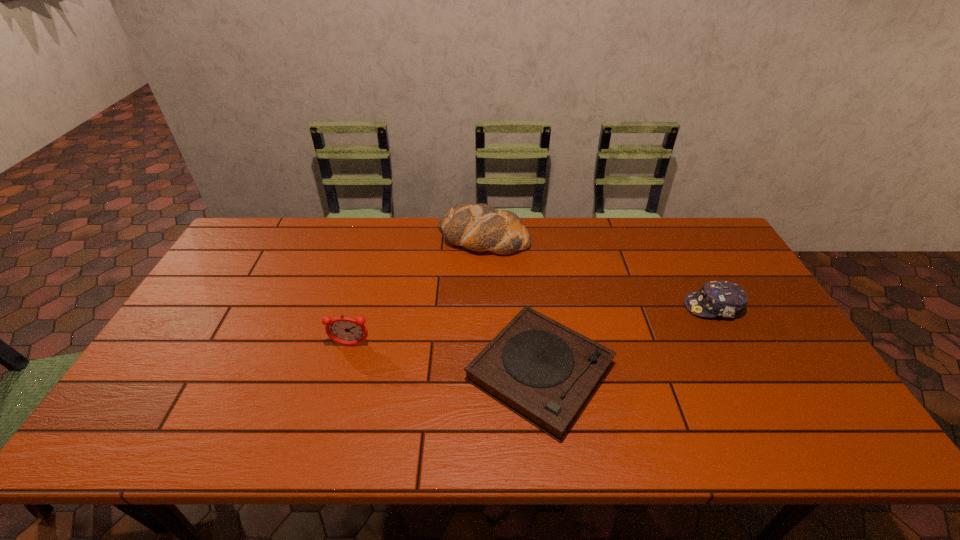
Find the location of a particular element. Image resolution: width=960 pixels, height=540 pixels. the farthest object is located at coordinates (480, 227).

At what (x,y) coordinates should I click in order to perform the action: click on alarm clock. Please return your answer as a coordinate pair (x, y). The height and width of the screenshot is (540, 960). Looking at the image, I should click on (343, 330).

Find the location of a particular element. headwear is located at coordinates (725, 299).

Find the location of a particular element. the second shortest object is located at coordinates (725, 299).

Locate an element on the screen. This screenshot has width=960, height=540. the shortest object is located at coordinates pyautogui.click(x=543, y=371).

This screenshot has width=960, height=540. I want to click on vacant space located on the left of the farthest object, so point(348,239).

Find the location of a particular element. free space located 0.050m on the front-facing side of the alarm clock is located at coordinates (x=346, y=364).

Locate an element on the screen. Image resolution: width=960 pixels, height=540 pixels. blank area located on the front-facing side of the second shortest object is located at coordinates (640, 307).

This screenshot has height=540, width=960. What are the coordinates of `vacant space located 0.140m on the front-facing side of the second shortest object` in the screenshot? It's located at (636, 307).

Image resolution: width=960 pixels, height=540 pixels. I want to click on vacant space located 0.120m on the front-facing side of the second shortest object, so click(x=643, y=307).